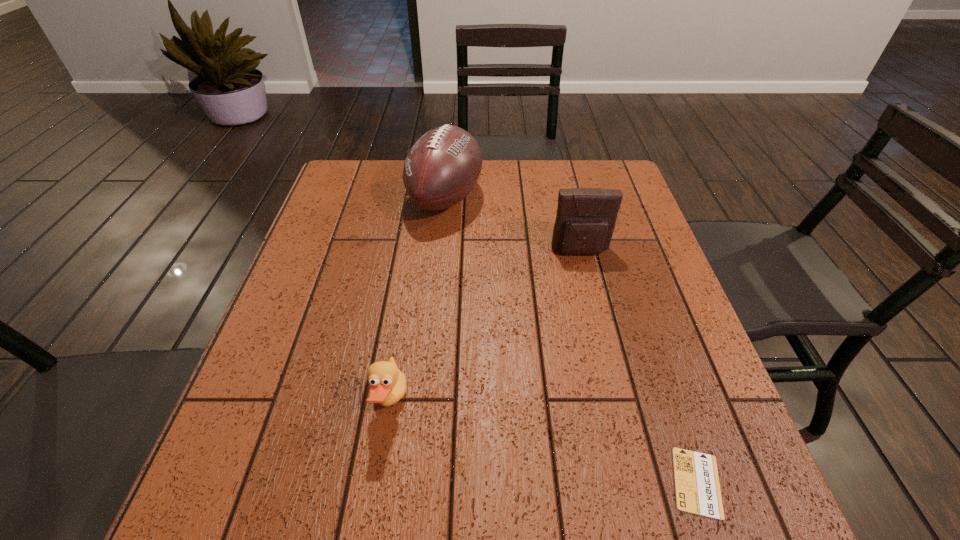
In order to click on vacant space at the right edge in this screenshot , I will do `click(637, 210)`.

In the image, there is a desktop. What are the coordinates of `vacant space at the far left corner` in the screenshot? It's located at (354, 165).

Locate an element on the screen. blank space at the near left corner of the desktop is located at coordinates (x=239, y=528).

The image size is (960, 540). In the image, there is a desktop. In order to click on vacant space at the near right corner in this screenshot , I will do `click(675, 529)`.

I want to click on blank region between the second shortest object and the tallest object, so click(x=418, y=300).

You are a GUI agent. You are given a task and a screenshot of the screen. Output one action in this format:
    pyautogui.click(x=<x>, y=<y>)
    Task: Click on the free space between the football (American) and the second nearest object
    The width and height of the screenshot is (960, 540).
    Given the screenshot: What is the action you would take?
    pyautogui.click(x=418, y=300)

Locate an element on the screen. free space between the shortest object and the tallest object is located at coordinates tap(571, 340).

You are a GUI agent. You are given a task and a screenshot of the screen. Output one action in this format:
    pyautogui.click(x=<x>, y=<y>)
    Task: Click on the free space between the tallest object and the pouch
    Image resolution: width=960 pixels, height=540 pixels.
    Given the screenshot: What is the action you would take?
    pyautogui.click(x=513, y=225)

This screenshot has width=960, height=540. I want to click on free area in between the pouch and the nearest object, so 638,367.

Find the location of a particular element. Image resolution: width=960 pixels, height=540 pixels. free spot between the football (American) and the third nearest object is located at coordinates (513, 225).